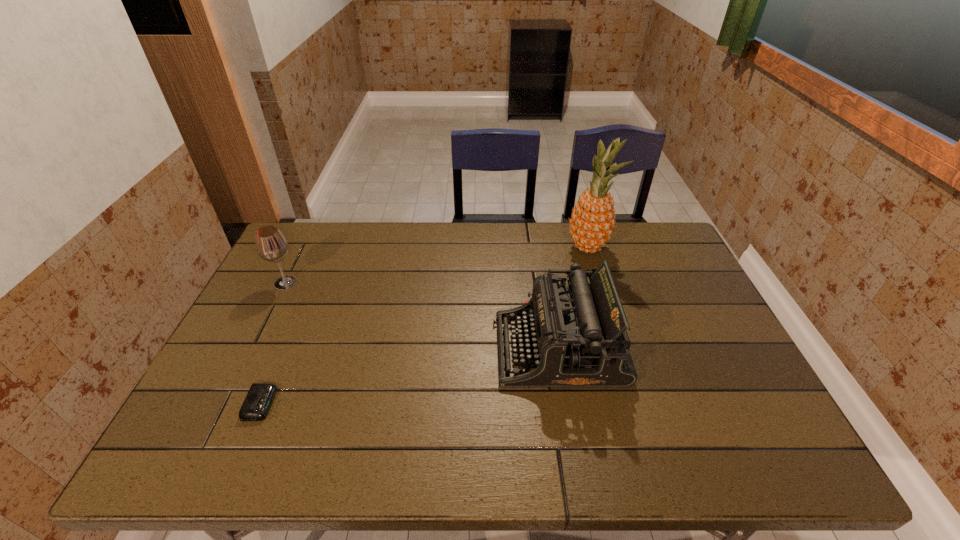
The height and width of the screenshot is (540, 960). Identify the location of vacant space located 0.110m on the keyboard of the typewriter. (452, 349).

This screenshot has height=540, width=960. Identify the location of vacant space located on the front of the leftmost object. (239, 377).

Where is `vacant space located on the display of the shortest object`? Image resolution: width=960 pixels, height=540 pixels. vacant space located on the display of the shortest object is located at coordinates (392, 404).

The image size is (960, 540). I want to click on object that is positioned at the far edge, so click(x=592, y=222).

Locate an element on the screen. Image resolution: width=960 pixels, height=540 pixels. wineglass positioned at the left edge is located at coordinates (271, 245).

The height and width of the screenshot is (540, 960). What are the coordinates of `alarm clock positioned at the left edge` in the screenshot? It's located at (259, 398).

The height and width of the screenshot is (540, 960). In order to click on free spot at the far edge of the desktop in this screenshot , I will do `click(449, 232)`.

Identify the location of vacant space at the near edge of the desktop. This screenshot has width=960, height=540. (495, 433).

Locate an element on the screen. Image resolution: width=960 pixels, height=540 pixels. free space at the right edge is located at coordinates (723, 388).

Identify the location of blank space at the far left corner. (324, 246).